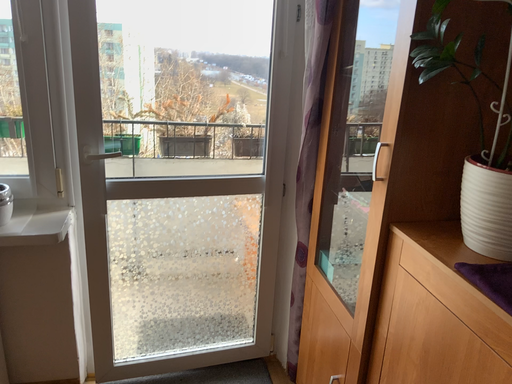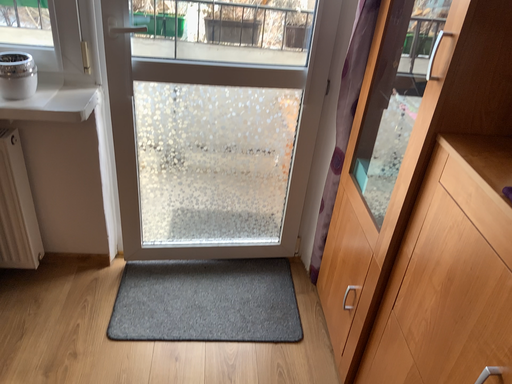
Question: Which way did the camera rotate in the video?

Choices:
 (A) rotated left
 (B) rotated right

Answer: (A)